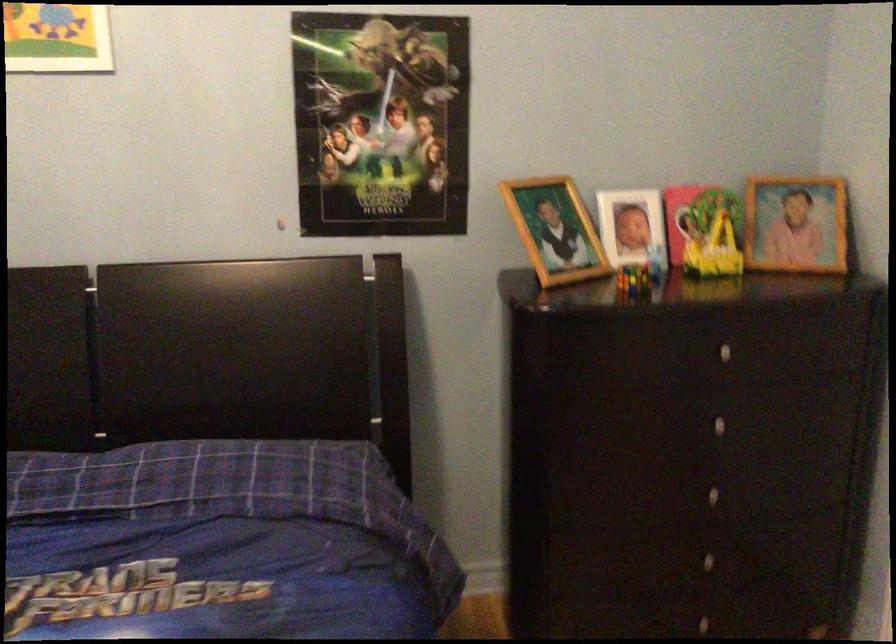
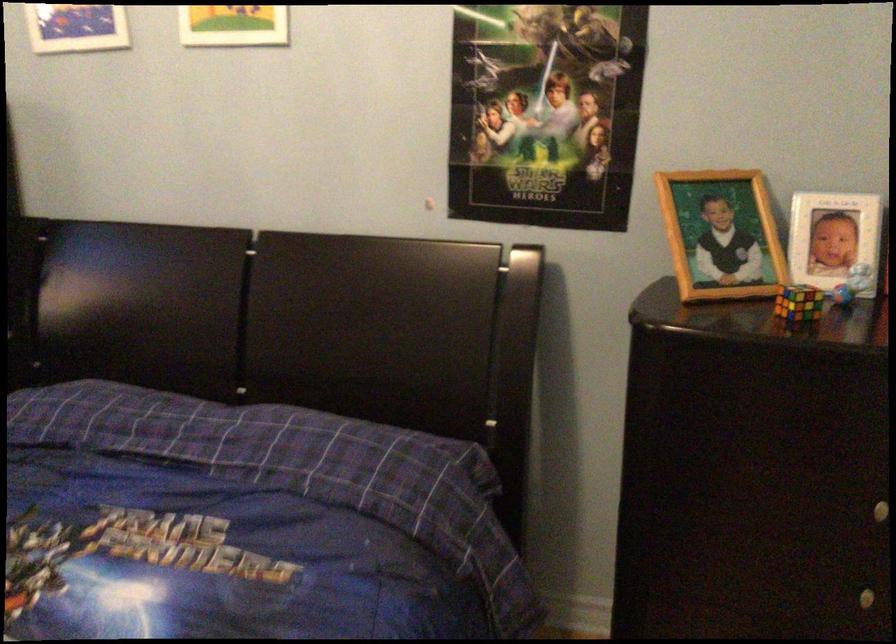
Find the pixel in the second image that matches pixel 652 254 in the first image.

(851, 283)